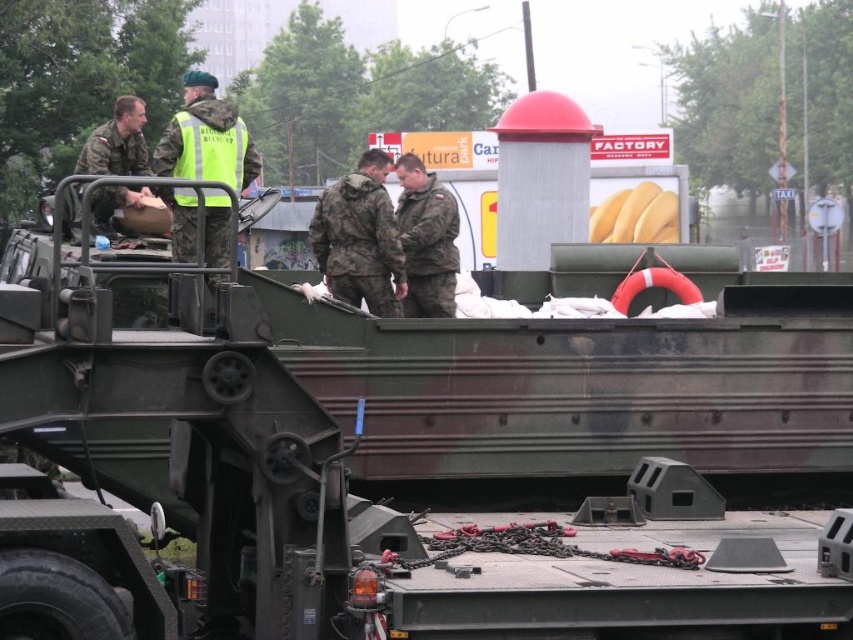
You are a soldier positioned at the front of the APC. You need to reach both the point at coordinates point (245, 166) and the point at coordinates point (415, 300). Which point should you reach first to minimize the distance walked?

You should reach point (245, 166) first because it is closer to your current position at the front of the APC compared to point (415, 300).

You are a military observer analyzing the scene. You notice two key items on the APC roof. The green reflective vest at upper center and the camouflage uniform at center. Which item is closer to the front of the APC?

The green reflective vest at upper center is closer to the front of the APC because it is positioned in front of the camouflage uniform at center.

You are a military observer assessing the scene. You notice the green reflective vest at upper center and the matte green uniform at left. Which item has a smaller width?

The green reflective vest at upper center has a smaller width than the matte green uniform at left.